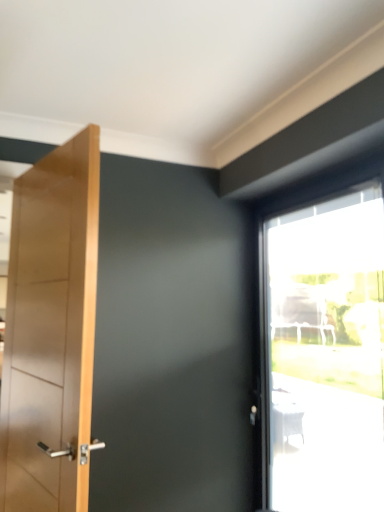
What do you see at coordinates (51, 330) in the screenshot? This screenshot has height=512, width=384. I see `light brown wooden door at left` at bounding box center [51, 330].

I want to click on light brown wooden door at left, so click(x=51, y=330).

What do you see at coordinates (324, 343) in the screenshot? I see `transparent glass window at upper right` at bounding box center [324, 343].

What is the approximate width of transparent glass window at upper right?

The width of transparent glass window at upper right is 20.40 centimeters.

From the picture: What is the approximate height of transparent glass window at upper right?

transparent glass window at upper right is 1.71 meters tall.

At what (x,y) coordinates should I click in order to perform the action: click on transparent glass window at upper right. Please return your answer as a coordinate pair (x, y). The height and width of the screenshot is (512, 384). Looking at the image, I should click on (324, 343).

The width and height of the screenshot is (384, 512). In order to click on light brown wooden door at left in this screenshot , I will do `click(51, 330)`.

Considering the relative positions of transparent glass window at upper right and light brown wooden door at left in the image provided, is transparent glass window at upper right to the right of light brown wooden door at left from the viewer's perspective?

Correct, you'll find transparent glass window at upper right to the right of light brown wooden door at left.

Which object is further away from the camera taking this photo, transparent glass window at upper right or light brown wooden door at left?

Positioned behind is transparent glass window at upper right.

Considering the points (323, 298) and (12, 338), which point is behind, point (323, 298) or point (12, 338)?

The point (323, 298) is more distant.

From the image's perspective, is transparent glass window at upper right beneath light brown wooden door at left?

Yes, from the image's perspective, transparent glass window at upper right is beneath light brown wooden door at left.

From a real-world perspective, which is physically above, transparent glass window at upper right or light brown wooden door at left?

light brown wooden door at left is physically above.

Is transparent glass window at upper right wider or thinner than light brown wooden door at left?

Considering their sizes, transparent glass window at upper right looks broader than light brown wooden door at left.

Considering the sizes of objects transparent glass window at upper right and light brown wooden door at left in the image provided, who is taller, transparent glass window at upper right or light brown wooden door at left?

transparent glass window at upper right is taller.

Considering the sizes of objects transparent glass window at upper right and light brown wooden door at left in the image provided, who is smaller, transparent glass window at upper right or light brown wooden door at left?

light brown wooden door at left is smaller.

Is light brown wooden door at left completely or partially inside transparent glass window at upper right?

No.

Is transparent glass window at upper right positioned far away from light brown wooden door at left?

Yes, transparent glass window at upper right is far from light brown wooden door at left.

Is transparent glass window at upper right oriented away from light brown wooden door at left?

Yes.

Can you tell me how much transparent glass window at upper right and light brown wooden door at left differ in facing direction?

15.4 degrees.

How distant is transparent glass window at upper right from light brown wooden door at left?

3.73 feet.

This screenshot has width=384, height=512. In order to click on window that appears below the light brown wooden door at left (from the image's perspective) in this screenshot , I will do `click(324, 343)`.

Is light brown wooden door at left to the right of transparent glass window at upper right from the viewer's perspective?

No.

Considering the positions of objects light brown wooden door at left and transparent glass window at upper right in the image provided, who is behind, light brown wooden door at left or transparent glass window at upper right?

transparent glass window at upper right is further away from the camera.

Which is nearer, (x=85, y=170) or (x=360, y=261)?

The point (x=85, y=170) is closer to the camera.

From the image's perspective, between light brown wooden door at left and transparent glass window at upper right, which one is located above?

light brown wooden door at left is shown above in the image.

From a real-world perspective, is light brown wooden door at left physically located above or below transparent glass window at upper right?

light brown wooden door at left is above transparent glass window at upper right.

Does light brown wooden door at left have a lesser width compared to transparent glass window at upper right?

Yes.

Who is taller, light brown wooden door at left or transparent glass window at upper right?

transparent glass window at upper right is taller.

Looking at the image, does light brown wooden door at left seem bigger or smaller compared to transparent glass window at upper right?

Clearly, light brown wooden door at left is smaller in size than transparent glass window at upper right.

Based on the photo, is light brown wooden door at left spatially inside transparent glass window at upper right, or outside of it?

light brown wooden door at left is spatially situated outside transparent glass window at upper right.

Is light brown wooden door at left beside transparent glass window at upper right?

light brown wooden door at left is not next to transparent glass window at upper right, and they're not touching.

Is light brown wooden door at left oriented away from transparent glass window at upper right?

That's right, light brown wooden door at left is facing away from transparent glass window at upper right.

How distant is light brown wooden door at left from transparent glass window at upper right?

A distance of 1.14 meters exists between light brown wooden door at left and transparent glass window at upper right.

At what (x,y) coordinates should I click in order to perform the action: click on door above the transparent glass window at upper right (from a real-world perspective). Please return your answer as a coordinate pair (x, y). This screenshot has width=384, height=512. Looking at the image, I should click on (51, 330).

Where is `window below the light brown wooden door at left (from a real-world perspective)`? Image resolution: width=384 pixels, height=512 pixels. window below the light brown wooden door at left (from a real-world perspective) is located at coordinates (324, 343).

You are a GUI agent. You are given a task and a screenshot of the screen. Output one action in this format:
    pyautogui.click(x=<x>, y=<y>)
    Task: Click on the window on the right of light brown wooden door at left
    The image size is (384, 512).
    Given the screenshot: What is the action you would take?
    pyautogui.click(x=324, y=343)